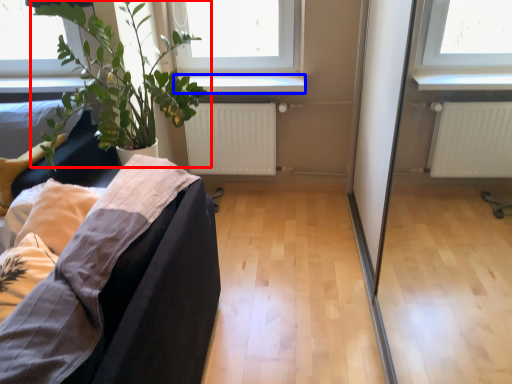
Question: Which of the following is the farthest to the observer, houseplant (highlighted by a red box) or window sill (highlighted by a blue box)?

Choices:
 (A) houseplant
 (B) window sill

Answer: (B)